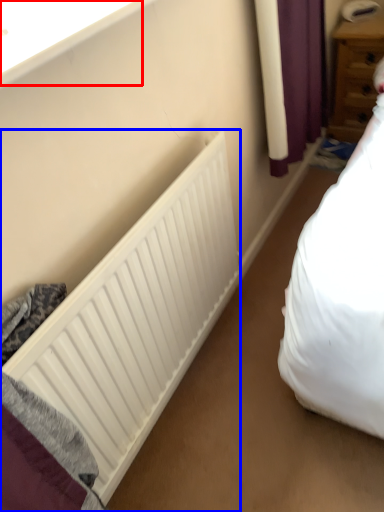
Question: Among these objects, which one is nearest to the camera, window sill (highlighted by a red box) or radiator (highlighted by a blue box)?

Choices:
 (A) window sill
 (B) radiator

Answer: (A)